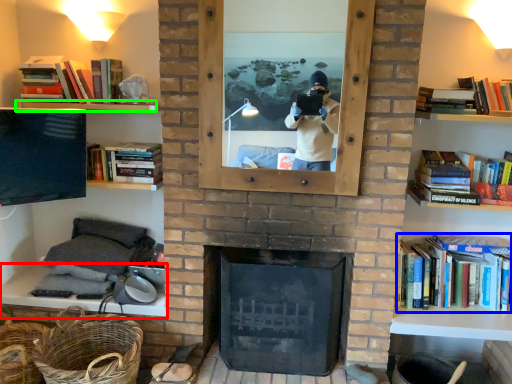
Question: Which object is the farthest from mantle (highlighted by a red box)? Choose among these: book (highlighted by a blue box) or shelf (highlighted by a green box).

Choices:
 (A) book
 (B) shelf

Answer: (A)